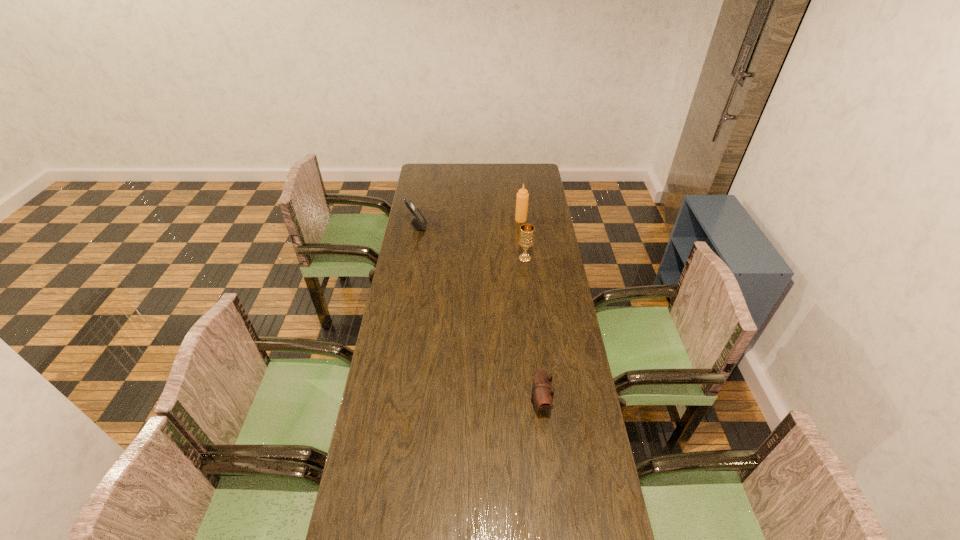
Find the location of `vacant space that is in between the cellular telephone and the third farthest object`. vacant space that is in between the cellular telephone and the third farthest object is located at coordinates (471, 242).

You are a GUI agent. You are given a task and a screenshot of the screen. Output one action in this format:
    pyautogui.click(x=<x>, y=<y>)
    Task: Click on the free space between the chalice and the leftmost object
    
    Given the screenshot: What is the action you would take?
    pyautogui.click(x=471, y=242)

Find the location of a particular element. The image size is (960, 540). free space between the cellular telephone and the third farthest object is located at coordinates (471, 242).

Where is `free space between the leftmost object and the second nearest object`? This screenshot has width=960, height=540. free space between the leftmost object and the second nearest object is located at coordinates (471, 242).

What are the coordinates of `vacant area between the tallest object and the cellular telephone` in the screenshot? It's located at (469, 223).

Image resolution: width=960 pixels, height=540 pixels. In order to click on empty space between the cellular telephone and the second nearest object in this screenshot , I will do `click(471, 242)`.

The image size is (960, 540). In order to click on object that is the closest to the condiment in this screenshot , I will do `click(526, 238)`.

Identify which object is the second nearest to the pouch. Please provide its 2D coordinates. Your answer should be formatted as a tuple, i.e. [(x, y)], where the tuple contains the x and y coordinates of a point satisfying the conditions above.

[(522, 198)]

I want to click on free space that satisfies the following two spatial constraints: 1. on the front-facing side of the cellular telephone; 2. on the right side of the chalice, so click(412, 258).

Image resolution: width=960 pixels, height=540 pixels. Find the location of `free point that satisfies the following two spatial constraints: 1. on the front-facing side of the cellular telephone; 2. on the back side of the third farthest object`. free point that satisfies the following two spatial constraints: 1. on the front-facing side of the cellular telephone; 2. on the back side of the third farthest object is located at coordinates (412, 258).